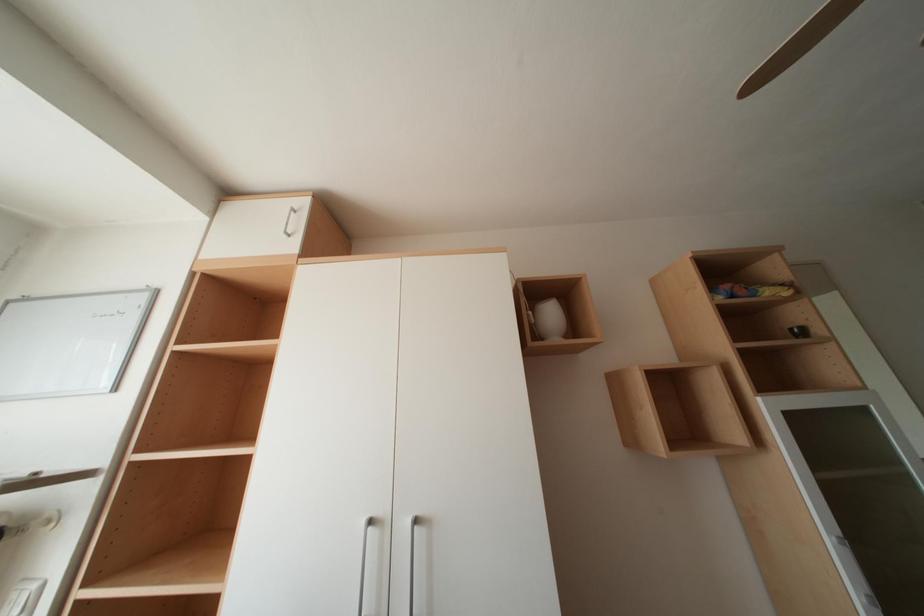
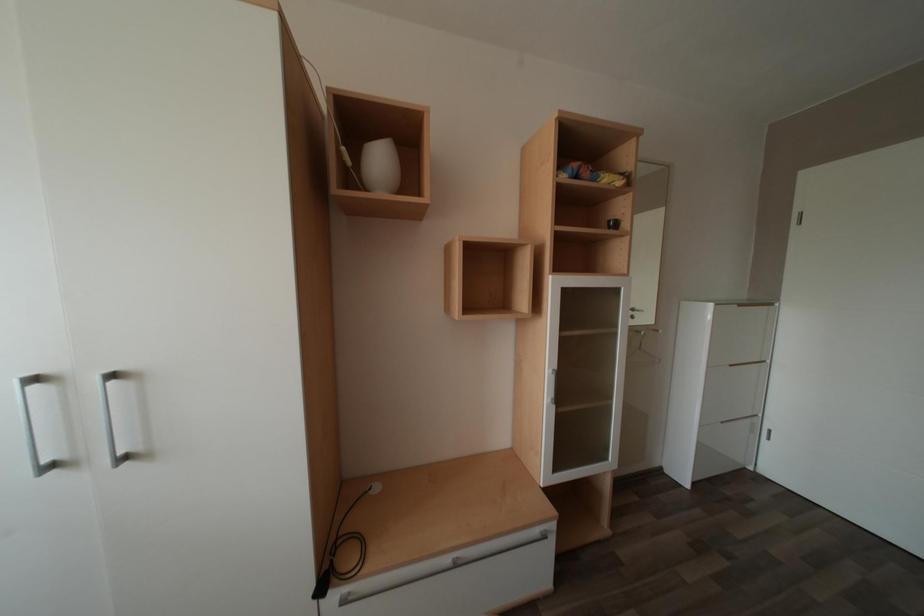
From the picture: Based on the continuous images, in which direction is the camera rotating?

The rotation direction of the camera is right-down.